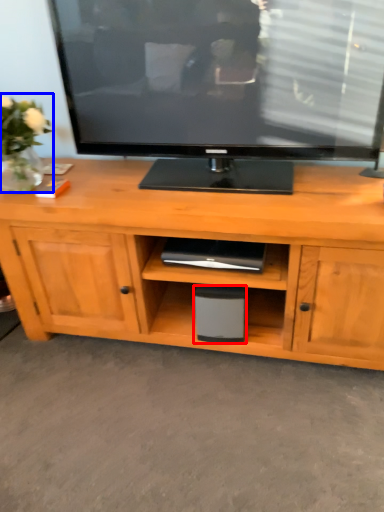
Question: Which object is further to the camera taking this photo, speaker (highlighted by a red box) or plant (highlighted by a blue box)?

Choices:
 (A) speaker
 (B) plant

Answer: (A)